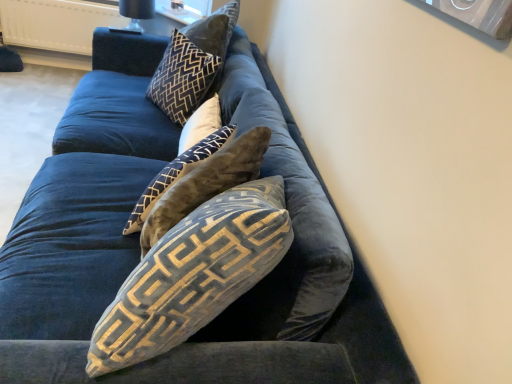
Question: Which direction should I rotate to look at velvet black pillow at upper center, the first pillow in the back-to-front sequence, — up or down?

Choices:
 (A) up
 (B) down

Answer: (A)

Question: Should I look upward or downward to see velvet brown pillow at center, the 3th pillow when ordered from front to back?

Choices:
 (A) up
 (B) down

Answer: (A)

Question: Does black glass lamp at upper center come in front of velvet beige pillow at center, the third pillow in the back-to-front sequence?

Choices:
 (A) yes
 (B) no

Answer: (B)

Question: Is black glass lamp at upper center surrounding velvet beige pillow at center, the third pillow in the back-to-front sequence?

Choices:
 (A) no
 (B) yes

Answer: (A)

Question: Would you say black glass lamp at upper center is a long distance from velvet beige pillow at center, the third pillow in the back-to-front sequence?

Choices:
 (A) no
 (B) yes

Answer: (B)

Question: Considering the relative sizes of black glass lamp at upper center and velvet beige pillow at center, the third pillow in the back-to-front sequence, in the image provided, is black glass lamp at upper center thinner than velvet beige pillow at center, the third pillow in the back-to-front sequence,?

Choices:
 (A) no
 (B) yes

Answer: (B)

Question: Could you tell me if black glass lamp at upper center is turned towards velvet beige pillow at center, which is the second pillow in front-to-back order?

Choices:
 (A) no
 (B) yes

Answer: (A)

Question: Is black glass lamp at upper center smaller than velvet beige pillow at center, which is the second pillow in front-to-back order?

Choices:
 (A) yes
 (B) no

Answer: (A)

Question: From a real-world perspective, is velvet black pillow at upper center, the first pillow in the back-to-front sequence, under velvet brown pillow at center, which appears as the second pillow when viewed from the back?

Choices:
 (A) yes
 (B) no

Answer: (B)

Question: Is velvet black pillow at upper center, the first pillow in the back-to-front sequence, far from velvet brown pillow at center, which appears as the second pillow when viewed from the back?

Choices:
 (A) no
 (B) yes

Answer: (A)

Question: From the image's perspective, is velvet black pillow at upper center, the first pillow in the back-to-front sequence, on top of velvet brown pillow at center, which appears as the second pillow when viewed from the back?

Choices:
 (A) no
 (B) yes

Answer: (B)

Question: Can you confirm if velvet black pillow at upper center, the first pillow in the back-to-front sequence, is smaller than velvet brown pillow at center, which appears as the second pillow when viewed from the back?

Choices:
 (A) no
 (B) yes

Answer: (A)

Question: Is the depth of velvet black pillow at upper center, the first pillow in the back-to-front sequence, less than that of velvet brown pillow at center, the 3th pillow when ordered from front to back?

Choices:
 (A) no
 (B) yes

Answer: (A)

Question: Is velvet black pillow at upper center, which is counted as the fourth pillow, starting from the front, next to velvet brown pillow at center, the 3th pillow when ordered from front to back?

Choices:
 (A) no
 (B) yes

Answer: (A)

Question: Considering the relative sizes of velvet black pillow at upper center, the first pillow in the back-to-front sequence, and velvet beige pillow at center, which is the second pillow in front-to-back order, in the image provided, is velvet black pillow at upper center, the first pillow in the back-to-front sequence, thinner than velvet beige pillow at center, which is the second pillow in front-to-back order,?

Choices:
 (A) no
 (B) yes

Answer: (A)